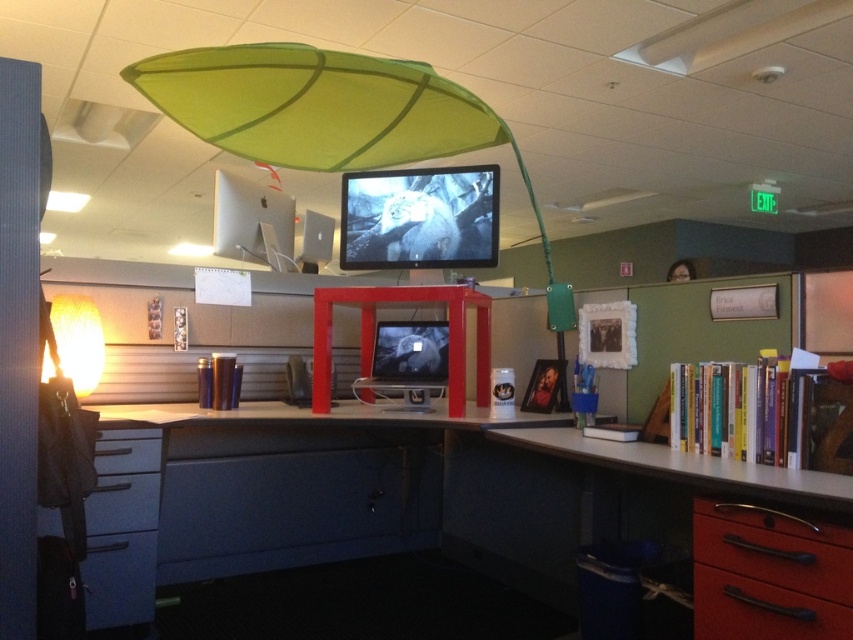
You are organizing your desk and need to access both the black metal drawer at lower right and the blue plastic drawer at lower left. Which drawer should you move first to reach the one below it?

The black metal drawer at lower right is located above the blue plastic drawer at lower left, so you should move the black metal drawer at lower right first to access the blue plastic drawer at lower left below it.

You are organizing your office and want to place a new plant between the matte gray computer desk at center and the black metal drawer at lower right. Based on their positions, where should you place the plant?

The matte gray computer desk at center is positioned on the left side of the black metal drawer at lower right, so you should place the plant between them on the right side of the matte gray computer desk at center and the left side of the black metal drawer at lower right.